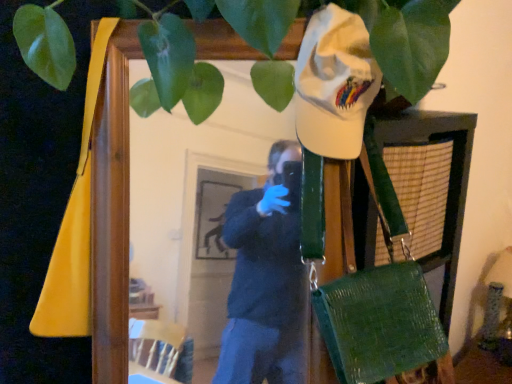
What is the approximate height of white fabric cap at upper right?

The height of white fabric cap at upper right is 11.24 inches.

What do you see at coordinates (334, 83) in the screenshot?
I see `white fabric cap at upper right` at bounding box center [334, 83].

The height and width of the screenshot is (384, 512). I want to click on white fabric cap at upper right, so click(334, 83).

This screenshot has width=512, height=384. Find the location of `white fabric cap at upper right`. white fabric cap at upper right is located at coordinates (334, 83).